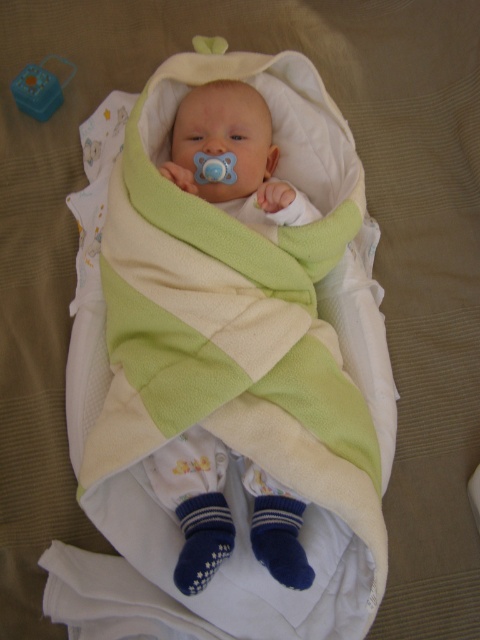
You are a caregiver holding a baby and need to place a pacifier within easy reach. The baby is currently at point (x=204, y=336). Where should you place the pacifier so it is closest to the baby but not directly on top?

The pacifier should be placed near the baby at point (x=204, y=336) but slightly offset to ensure it is within reach without being directly on top.

You are a parent holding the blue rubber pacifier at center and want to place it next to the blue plastic toy at upper left. Can you determine if the pacifier will fit under the toy without overlapping?

The blue plastic toy at upper left is taller than the blue rubber pacifier at center. Since the toy is taller, there should be enough vertical space for the pacifier to fit underneath without overlapping.

You are a photographer taking a closeup shot of the soft fleece baby at center and the blue rubber pacifier at center. If you want to ensure both are fully visible in the frame, which object should you focus on to account for their sizes?

Since the soft fleece baby at center is wider than the blue rubber pacifier at center, you should focus on the soft fleece baby at center to ensure both fit within the frame.